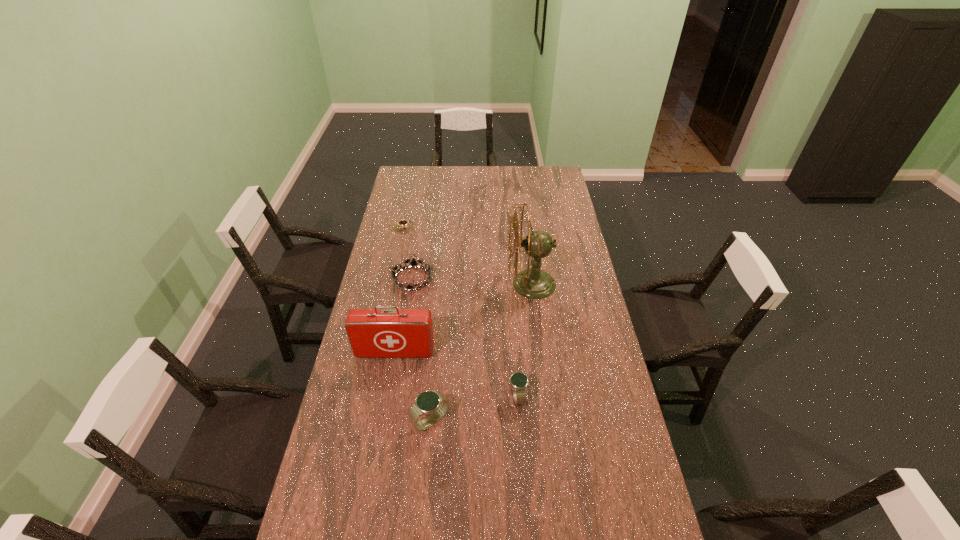
I want to click on the second watch from right to left, so click(x=433, y=402).

Where is `the tallest watch`? The height and width of the screenshot is (540, 960). the tallest watch is located at coordinates (433, 402).

Find the location of a particular element. the third shortest object is located at coordinates (518, 380).

Where is `the rightmost watch`? This screenshot has width=960, height=540. the rightmost watch is located at coordinates (518, 380).

At what (x,y) coordinates should I click in order to perform the action: click on the leftmost watch. Please return your answer as a coordinate pair (x, y). Looking at the image, I should click on (402, 222).

This screenshot has width=960, height=540. In order to click on the shortest watch in this screenshot , I will do coord(402,222).

What are the coordinates of `the third nearest object` in the screenshot? It's located at (373, 333).

The width and height of the screenshot is (960, 540). I want to click on the first-aid kit, so click(373, 333).

Image resolution: width=960 pixels, height=540 pixels. I want to click on fan, so click(534, 283).

I want to click on tiara, so tap(413, 263).